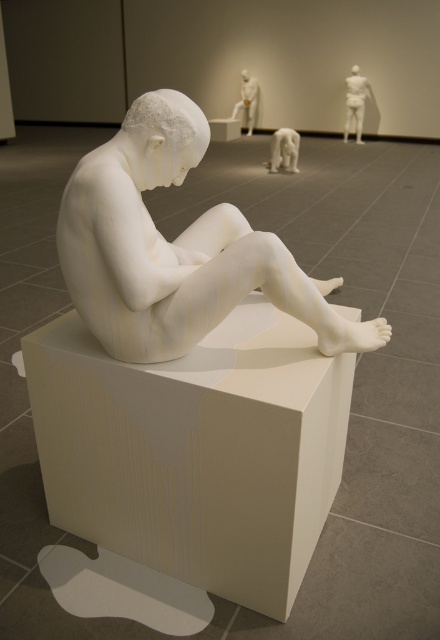
Does white matte torso at upper right appear on the right side of white glossy statue at upper center?

Yes, white matte torso at upper right is to the right of white glossy statue at upper center.

Which is more to the right, white matte torso at upper right or white glossy statue at upper center?

From the viewer's perspective, white matte torso at upper right appears more on the right side.

Where is `white matte torso at upper right`? The height and width of the screenshot is (640, 440). white matte torso at upper right is located at coordinates (355, 102).

Image resolution: width=440 pixels, height=640 pixels. Find the location of `white matte torso at upper right`. white matte torso at upper right is located at coordinates (355, 102).

Consider the image. Who is taller, white matte cube at center or white glossy bear at center?

With more height is white matte cube at center.

Does point (124, 406) come farther from viewer compared to point (282, 156)?

No, (124, 406) is in front of (282, 156).

This screenshot has width=440, height=640. I want to click on white matte cube at center, so click(195, 449).

Is white matte sculpture at center to the right of white glossy statue at upper center from the viewer's perspective?

Incorrect, white matte sculpture at center is not on the right side of white glossy statue at upper center.

In the scene shown: Between white matte sculpture at center and white glossy statue at upper center, which one is positioned lower?

white matte sculpture at center is lower down.

Is point (129, 348) positioned after point (249, 104)?

That is False.

Where is `white matte sculpture at center`? This screenshot has width=440, height=640. white matte sculpture at center is located at coordinates (176, 248).